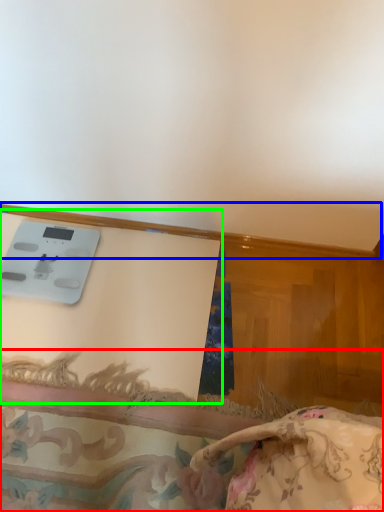
Question: Which is farther away from furniture (highlighted by a red box)? trim (highlighted by a blue box) or table (highlighted by a green box)?

Choices:
 (A) trim
 (B) table

Answer: (A)